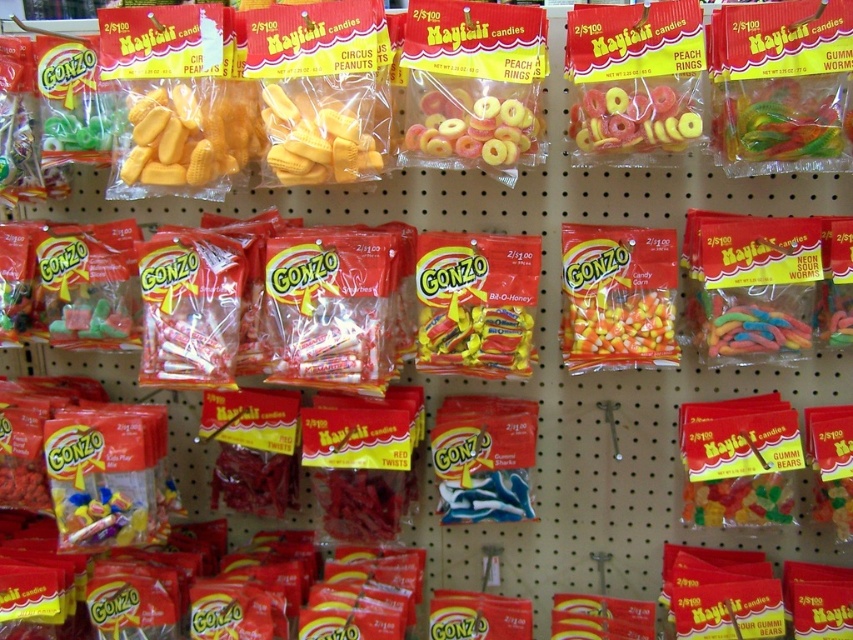
Who is lower down, translucent rubber rings at center or translucent pink rings at center?

translucent rubber rings at center is below.

How distant is translucent rubber rings at center from translucent pink rings at center?

translucent rubber rings at center is 16.22 centimeters away from translucent pink rings at center.

Who is more distant from viewer, (451, 134) or (694, 131)?

The point (451, 134) is behind.

This screenshot has height=640, width=853. I want to click on translucent rubber rings at center, so click(x=473, y=125).

Is translucent rubber gummy worms at upper right below yellow rubber gummy at center?

Actually, translucent rubber gummy worms at upper right is above yellow rubber gummy at center.

Looking at this image, does translucent rubber gummy worms at upper right have a smaller size compared to yellow rubber gummy at center?

Actually, translucent rubber gummy worms at upper right might be larger than yellow rubber gummy at center.

Which is behind, point (724, 161) or point (312, 104)?

Positioned behind is point (724, 161).

Identify the location of translucent rubber gummy worms at upper right. (782, 122).

Between translucent rubber gummy worms at upper right and translucent rubber rings at center, which one has less height?

translucent rubber rings at center is shorter.

What are the coordinates of `translucent rubber gummy worms at upper right` in the screenshot? It's located at (782, 122).